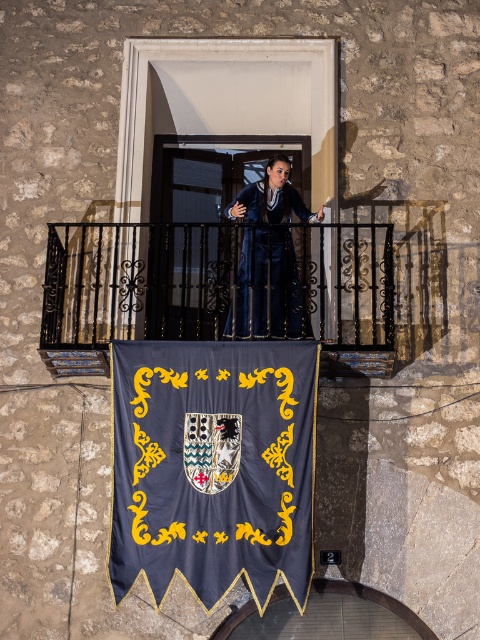
Question: Can you confirm if dark blue fabric banner at center is positioned to the right of velvet blue business suit at center?

Choices:
 (A) yes
 (B) no

Answer: (B)

Question: Can you confirm if dark blue fabric banner at center is wider than black wrought iron balustrade at center?

Choices:
 (A) yes
 (B) no

Answer: (B)

Question: Which of the following is the farthest from the observer?

Choices:
 (A) velvet blue business suit at center
 (B) dark blue fabric banner at center

Answer: (A)

Question: Which point is farther to the camera?

Choices:
 (A) black wrought iron balustrade at center
 (B) velvet blue business suit at center

Answer: (B)

Question: Which object is closer to the camera taking this photo?

Choices:
 (A) black wrought iron balustrade at center
 (B) velvet blue business suit at center

Answer: (A)

Question: Does dark blue fabric banner at center have a smaller size compared to velvet blue business suit at center?

Choices:
 (A) no
 (B) yes

Answer: (A)